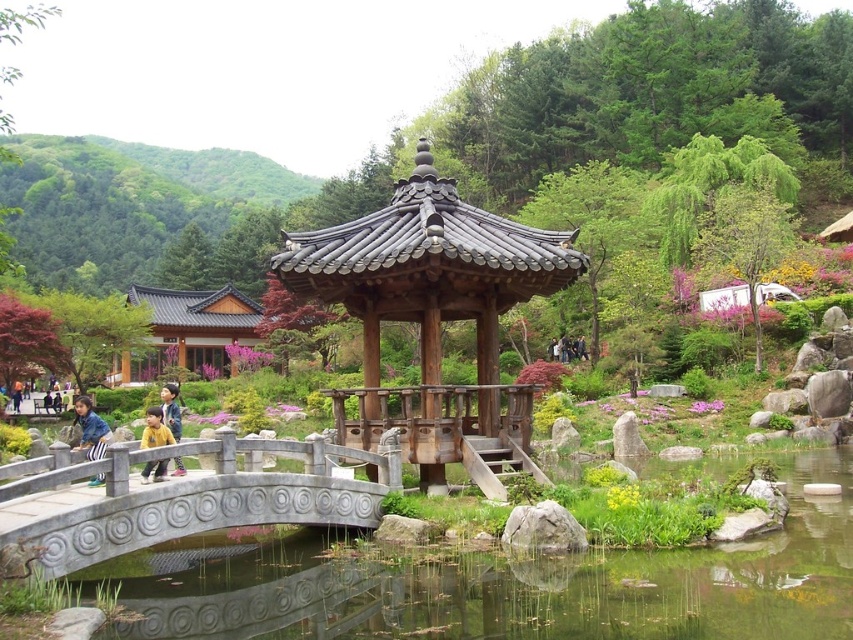
You are standing at the entrance of the pavilion and see the denim jacket at lower left and the yellow matte jacket at center. Which jacket is closer to the ground?

The denim jacket at lower left is located below the yellow matte jacket at center, so it is closer to the ground.

You are standing at the entrance of the pavilion and see a denim jacket at lower left and a yellow matte jacket at center. Which jacket is closer to you?

The denim jacket at lower left is closer to you since it is only 3.68 feet away from the yellow matte jacket at center, but since you are at the entrance of the pavilion, the distance from you to each jacket would depend on their positions relative to your location. However, based on the given information, the denim jacket at lower left is positioned closer to the entrance than the yellow matte jacket at center.